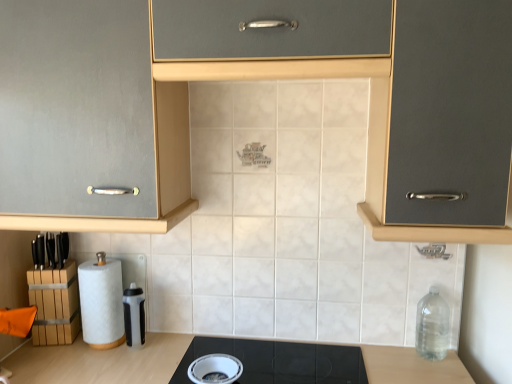
Question: From a real-world perspective, is matte gray cabinet at center above or below white glossy bowl at lower center, which is the 2th appliance in top-to-bottom order?

Choices:
 (A) above
 (B) below

Answer: (A)

Question: Is matte gray cabinet at center to the left or to the right of white glossy bowl at lower center, which is counted as the 1th appliance, starting from the bottom, in the image?

Choices:
 (A) right
 (B) left

Answer: (A)

Question: Estimate the real-world distances between objects in this image. Which object is closer to the translucent plastic water bottle at lower center, acting as the second appliance starting from the front?

Choices:
 (A) black glass cooktop at center
 (B) clear plastic bottle at right
 (C) white matte paper towel at lower left
 (D) white glossy bowl at lower center, which is counted as the 1th appliance, starting from the front
 (E) matte gray cabinet at center

Answer: (C)

Question: Considering the real-world distances, which object is farthest from the matte gray cabinet at center?

Choices:
 (A) translucent plastic water bottle at lower center, the 2th appliance in the right-to-left sequence
 (B) white matte paper towel at lower left
 (C) black glass cooktop at center
 (D) clear plastic bottle at right
 (E) white glossy bowl at lower center, marked as the second appliance in a left-to-right arrangement

Answer: (D)